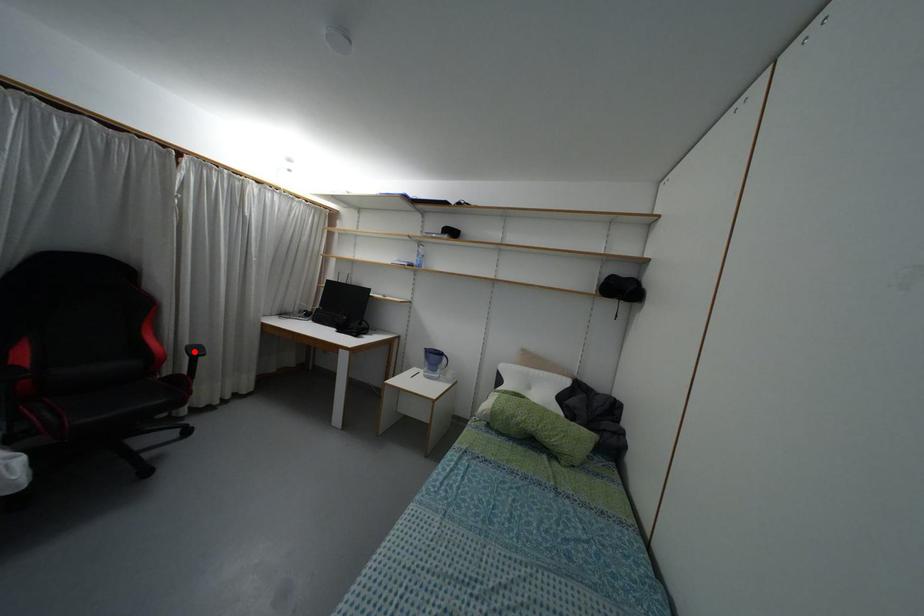
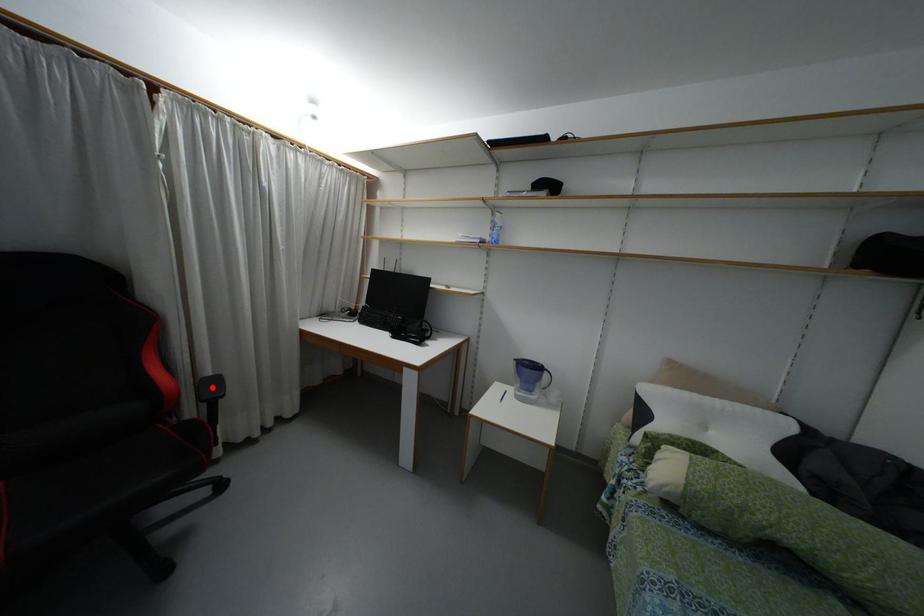
I am providing you with two images of the same scene from different viewpoints. A red point is marked on the first image and another point is marked on the second image. Does the point marked in image1 correspond to the same location as the one in image2?

Yes